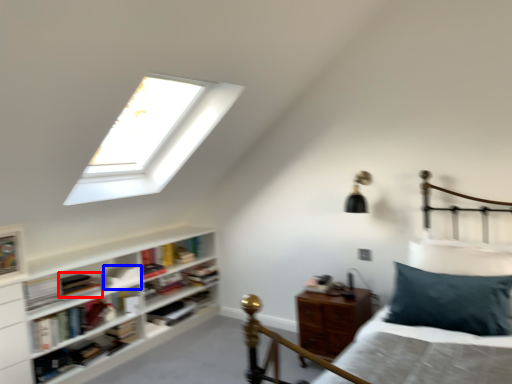
Question: Which object is closer to the camera taking this photo, book (highlighted by a red box) or book (highlighted by a blue box)?

Choices:
 (A) book
 (B) book

Answer: (A)